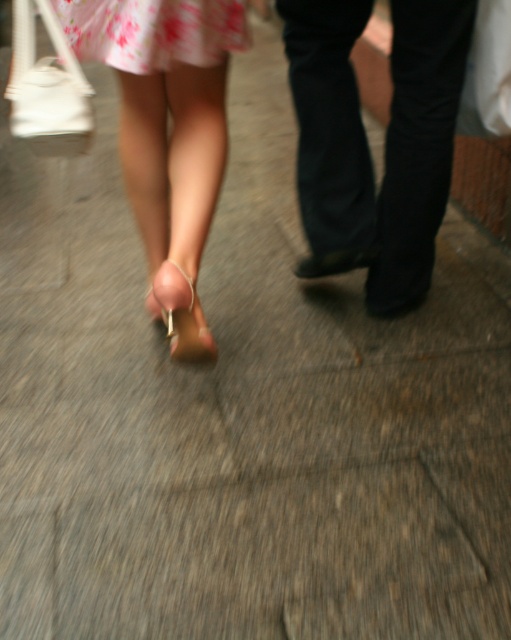
Question: Which of the following is the farthest from the observer?

Choices:
 (A) (204, 340)
 (B) (350, 256)

Answer: (B)

Question: Can you confirm if matte pink heels at center is positioned above satin beige sandal at lower center?

Choices:
 (A) no
 (B) yes

Answer: (B)

Question: Which point is closer to the camera?

Choices:
 (A) black leather shoe at center
 (B) matte pink heels at center
 (C) pink floral fabric dress at upper left

Answer: (C)

Question: Can you confirm if black leather pants at center is positioned to the left of matte pink heels at center?

Choices:
 (A) yes
 (B) no

Answer: (B)

Question: Is satin beige sandal at lower center above black leather shoe at center?

Choices:
 (A) no
 (B) yes

Answer: (A)

Question: Which object is closer to the camera taking this photo?

Choices:
 (A) pink floral fabric dress at upper left
 (B) black leather pants at center

Answer: (A)